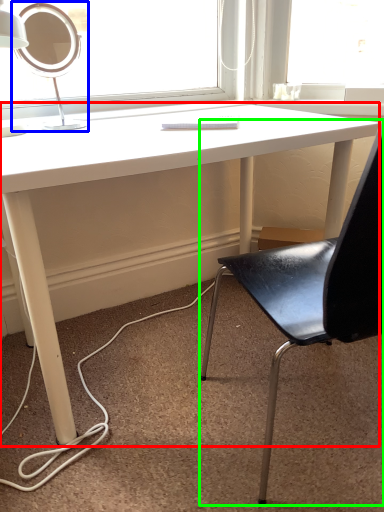
Question: Based on their relative distances, which object is farther from desk (highlighted by a red box)? Choose from table lamp (highlighted by a blue box) and chair (highlighted by a green box).

Choices:
 (A) table lamp
 (B) chair

Answer: (B)